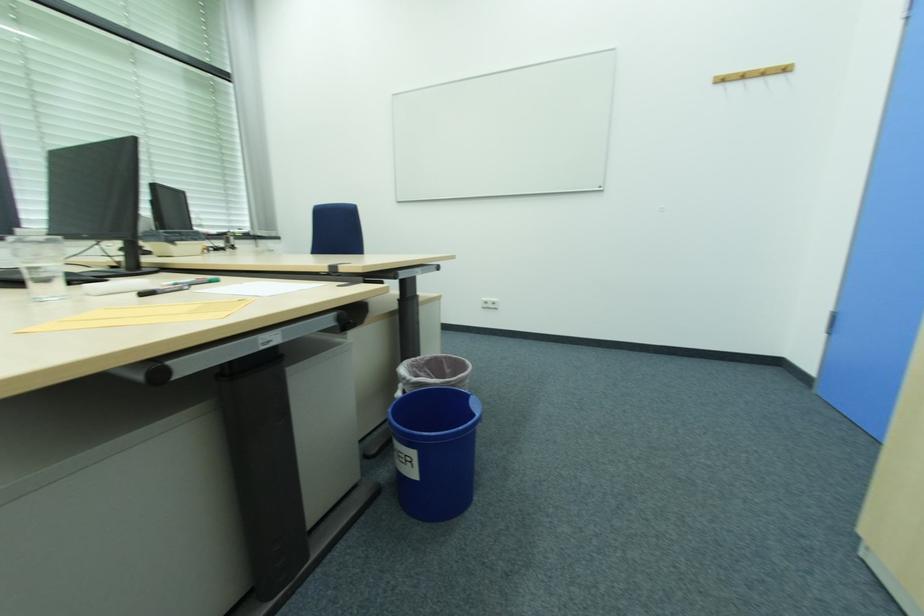
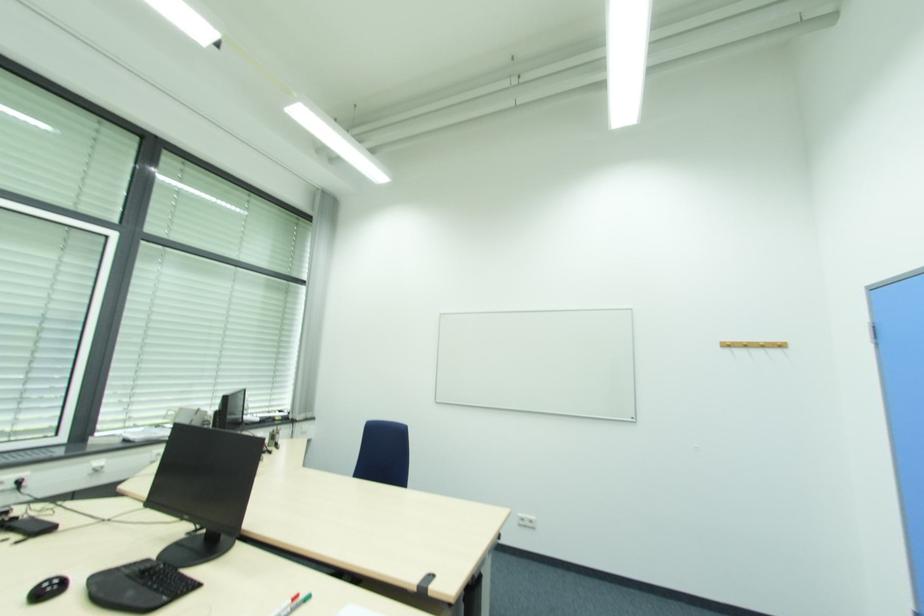
Where in the second image is the point corresponding to (787,70) from the first image?

(784, 346)